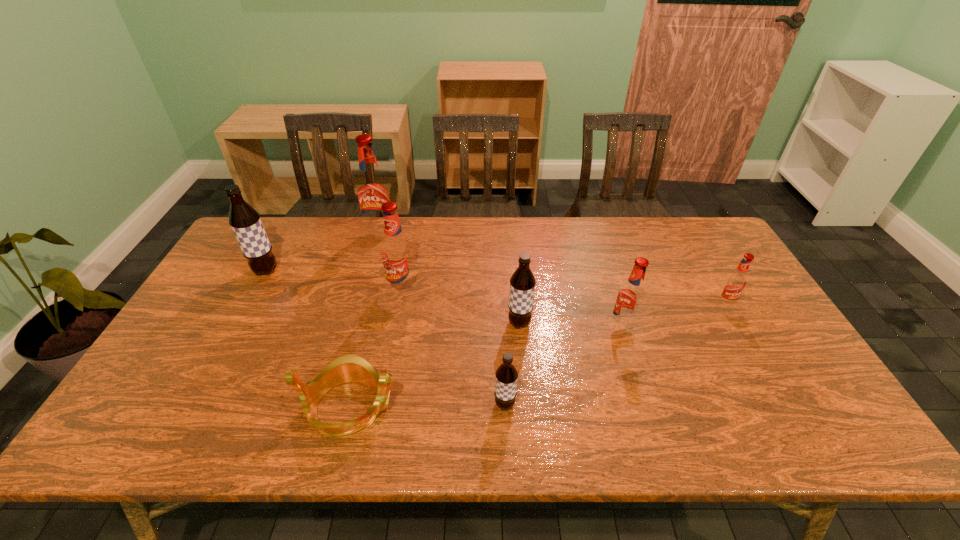
Identify the location of the rightmost red root beer. This screenshot has height=540, width=960. (735, 283).

You are a GUI agent. You are given a task and a screenshot of the screen. Output one action in this format:
    pyautogui.click(x=<x>, y=<y>)
    Task: Click on the smallest brown root beer
    The image size is (960, 540).
    Given the screenshot: What is the action you would take?
    pyautogui.click(x=506, y=374)

You are a GUI agent. You are given a task and a screenshot of the screen. Output one action in this format:
    pyautogui.click(x=<x>, y=<y>)
    Task: Click on the nearest brown root beer
    The width and height of the screenshot is (960, 540).
    Given the screenshot: What is the action you would take?
    pyautogui.click(x=506, y=374)

At what (x,y) coordinates should I click in order to perform the action: click on tiara. Please return your answer as a coordinate pair (x, y). Looking at the image, I should click on (350, 368).

Where is `gold tiara`? gold tiara is located at coordinates (350, 368).

Find the location of a particular element. The width and height of the screenshot is (960, 540). free space located on the left of the farthest object is located at coordinates (306, 235).

Identify the location of vacant space located on the right of the third smallest red root beer. (492, 289).

The height and width of the screenshot is (540, 960). Identify the location of vacant space located on the back of the leftmost object. (290, 228).

The height and width of the screenshot is (540, 960). I want to click on vacant region located on the right of the third red root beer from left to right, so click(x=780, y=328).

At what (x,y) coordinates should I click in order to perform the action: click on free point located on the left of the second farthest brown root beer. Please return your answer as a coordinate pair (x, y). This screenshot has height=540, width=960. Looking at the image, I should click on (468, 323).